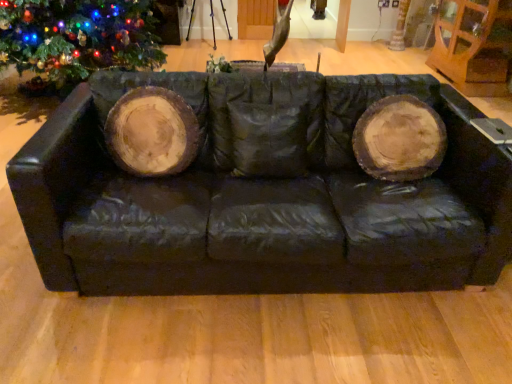
Question: Should I look upward or downward to see brown wood tree trunk at upper right?

Choices:
 (A) down
 (B) up

Answer: (B)

Question: Is brown wood tree trunk at upper right shorter than green matte christmas tree at left?

Choices:
 (A) yes
 (B) no

Answer: (A)

Question: Is brown wood tree trunk at upper right taller than green matte christmas tree at left?

Choices:
 (A) yes
 (B) no

Answer: (B)

Question: From a real-world perspective, is brown wood tree trunk at upper right positioned under green matte christmas tree at left based on gravity?

Choices:
 (A) no
 (B) yes

Answer: (B)

Question: Is brown wood tree trunk at upper right far from green matte christmas tree at left?

Choices:
 (A) yes
 (B) no

Answer: (A)

Question: Is brown wood tree trunk at upper right wider than green matte christmas tree at left?

Choices:
 (A) yes
 (B) no

Answer: (B)

Question: Would you say brown wood tree trunk at upper right is outside green matte christmas tree at left?

Choices:
 (A) yes
 (B) no

Answer: (A)

Question: Is black leather couch at center taller than green matte christmas tree at left?

Choices:
 (A) no
 (B) yes

Answer: (A)

Question: Does black leather couch at center have a greater width compared to green matte christmas tree at left?

Choices:
 (A) no
 (B) yes

Answer: (A)

Question: From the image's perspective, does black leather couch at center appear higher than green matte christmas tree at left?

Choices:
 (A) no
 (B) yes

Answer: (A)

Question: Considering the relative sizes of black leather couch at center and green matte christmas tree at left in the image provided, is black leather couch at center bigger than green matte christmas tree at left?

Choices:
 (A) yes
 (B) no

Answer: (B)

Question: Could you tell me if black leather couch at center is facing green matte christmas tree at left?

Choices:
 (A) no
 (B) yes

Answer: (A)

Question: From a real-world perspective, is black leather couch at center beneath green matte christmas tree at left?

Choices:
 (A) no
 (B) yes

Answer: (B)

Question: Does brown wood tree trunk at upper right appear on the right side of black leather couch at center?

Choices:
 (A) yes
 (B) no

Answer: (A)